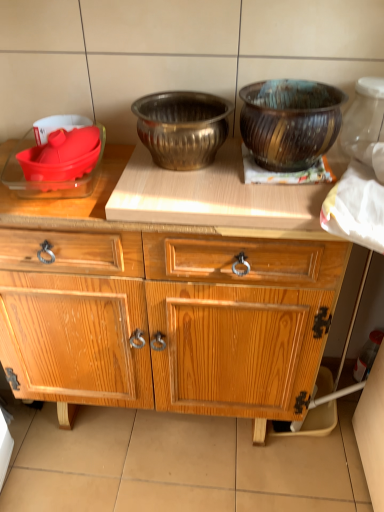
Question: Considering the relative sizes of wooden textured bowl at upper right, the fourth bowl in the left-to-right sequence, and translucent glass jar at upper right in the image provided, is wooden textured bowl at upper right, the fourth bowl in the left-to-right sequence, smaller than translucent glass jar at upper right?

Choices:
 (A) no
 (B) yes

Answer: (A)

Question: Considering the relative sizes of wooden textured bowl at upper right, which appears as the first bowl when viewed from the right, and translucent glass jar at upper right in the image provided, is wooden textured bowl at upper right, which appears as the first bowl when viewed from the right, thinner than translucent glass jar at upper right?

Choices:
 (A) yes
 (B) no

Answer: (B)

Question: Considering the relative sizes of wooden textured bowl at upper right, the fourth bowl in the left-to-right sequence, and translucent glass jar at upper right in the image provided, is wooden textured bowl at upper right, the fourth bowl in the left-to-right sequence, shorter than translucent glass jar at upper right?

Choices:
 (A) no
 (B) yes

Answer: (B)

Question: Is translucent glass jar at upper right completely or partially inside wooden textured bowl at upper right, the fourth bowl in the left-to-right sequence?

Choices:
 (A) no
 (B) yes

Answer: (A)

Question: Is wooden textured bowl at upper right, the fourth bowl in the left-to-right sequence, outside of translucent glass jar at upper right?

Choices:
 (A) no
 (B) yes

Answer: (B)

Question: Is wooden textured bowl at upper right, which appears as the first bowl when viewed from the right, bigger or smaller than wooden cabinet at center?

Choices:
 (A) small
 (B) big

Answer: (A)

Question: Considering the positions of wooden textured bowl at upper right, the fourth bowl in the left-to-right sequence, and wooden cabinet at center in the image, is wooden textured bowl at upper right, the fourth bowl in the left-to-right sequence, taller or shorter than wooden cabinet at center?

Choices:
 (A) short
 (B) tall

Answer: (A)

Question: Considering the positions of wooden textured bowl at upper right, which appears as the first bowl when viewed from the right, and wooden cabinet at center in the image, is wooden textured bowl at upper right, which appears as the first bowl when viewed from the right, wider or thinner than wooden cabinet at center?

Choices:
 (A) wide
 (B) thin

Answer: (B)

Question: Considering the positions of point (296, 162) and point (84, 309), is point (296, 162) closer or farther from the camera than point (84, 309)?

Choices:
 (A) farther
 (B) closer

Answer: (B)

Question: Based on their sizes in the image, would you say wooden textured bowl at upper right, which appears as the first bowl when viewed from the right, is bigger or smaller than translucent glass jar at upper right?

Choices:
 (A) big
 (B) small

Answer: (A)

Question: Is wooden textured bowl at upper right, which appears as the first bowl when viewed from the right, situated inside translucent glass jar at upper right or outside?

Choices:
 (A) outside
 (B) inside

Answer: (A)

Question: Is wooden textured bowl at upper right, the fourth bowl in the left-to-right sequence, taller or shorter than translucent glass jar at upper right?

Choices:
 (A) short
 (B) tall

Answer: (A)

Question: From a real-world perspective, is wooden textured bowl at upper right, which appears as the first bowl when viewed from the right, physically located above or below translucent glass jar at upper right?

Choices:
 (A) below
 (B) above

Answer: (A)

Question: From the image's perspective, is brushed metal bowl at center, the second bowl from the right, positioned above or below wooden cabinet at center?

Choices:
 (A) below
 (B) above

Answer: (B)

Question: Is brushed metal bowl at center, the 3th bowl viewed from the left, taller or shorter than wooden cabinet at center?

Choices:
 (A) short
 (B) tall

Answer: (A)